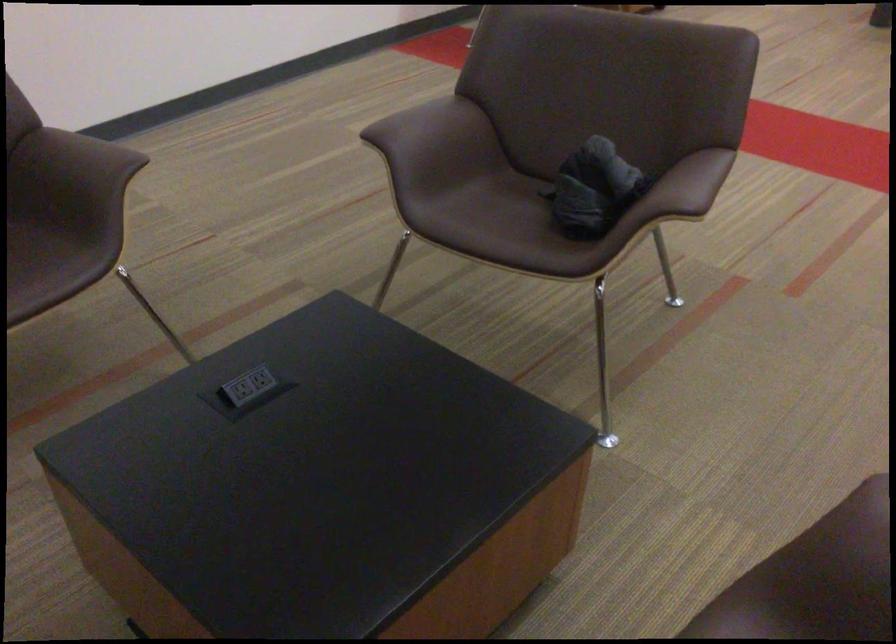
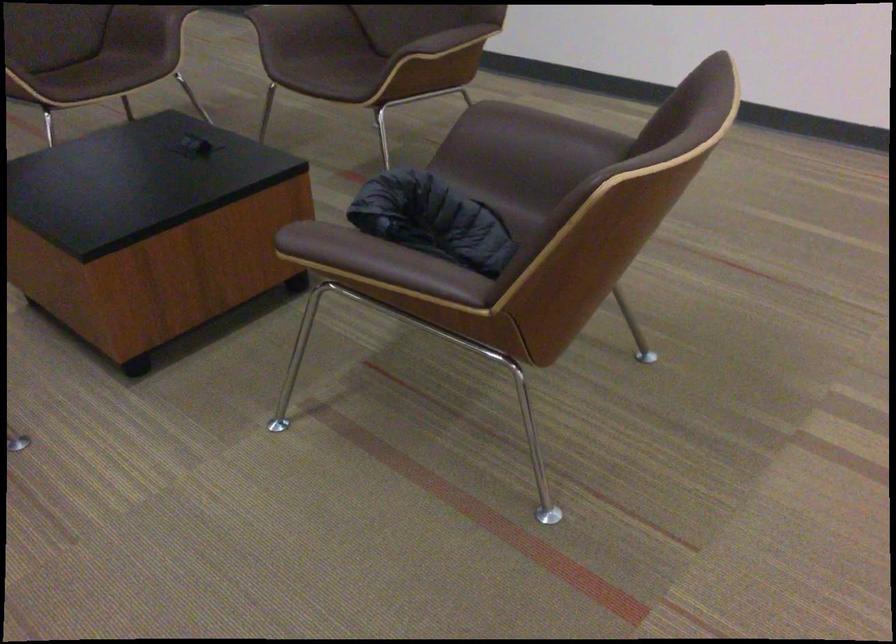
Find the pixel in the second image that matches the point at 690,174 in the first image.

(355, 250)